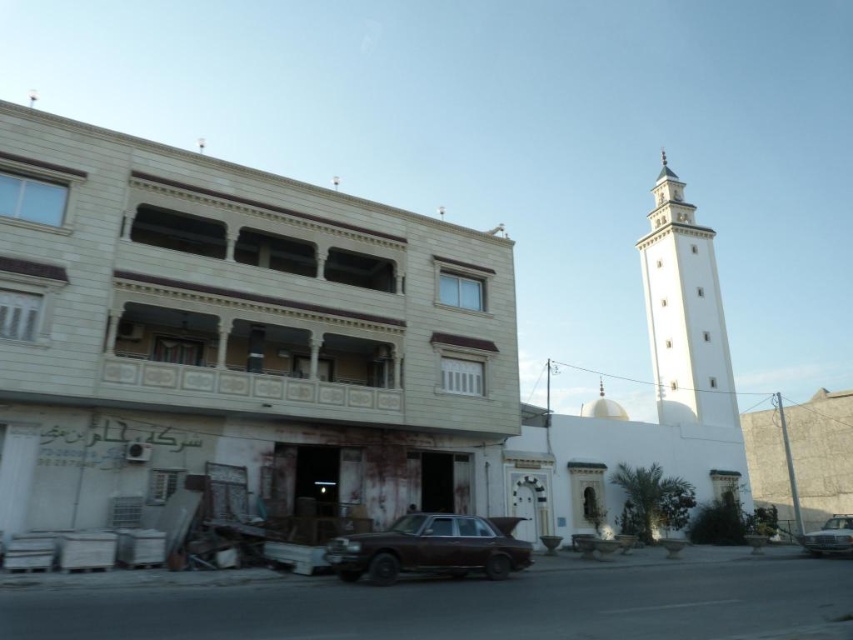
Does white marble minaret at upper right have a lesser width compared to brown matte car at center?

Incorrect, white marble minaret at upper right's width is not less than brown matte car at center's.

Is point (706, 253) more distant than point (508, 547)?

That is True.

This screenshot has height=640, width=853. In order to click on white marble minaret at upper right in this screenshot , I will do `click(683, 310)`.

Who is more distant from viewer, (706, 241) or (822, 529)?

Point (706, 241)

Where is `white marble minaret at upper right`? This screenshot has width=853, height=640. white marble minaret at upper right is located at coordinates (683, 310).

Is brown matte car at center below brown metallic car at center?

No.

Where is `brown matte car at center`? This screenshot has height=640, width=853. brown matte car at center is located at coordinates (428, 548).

This screenshot has height=640, width=853. Find the location of `brown matte car at center`. brown matte car at center is located at coordinates (428, 548).

Where is `brown matte car at center`? Image resolution: width=853 pixels, height=640 pixels. brown matte car at center is located at coordinates (428, 548).